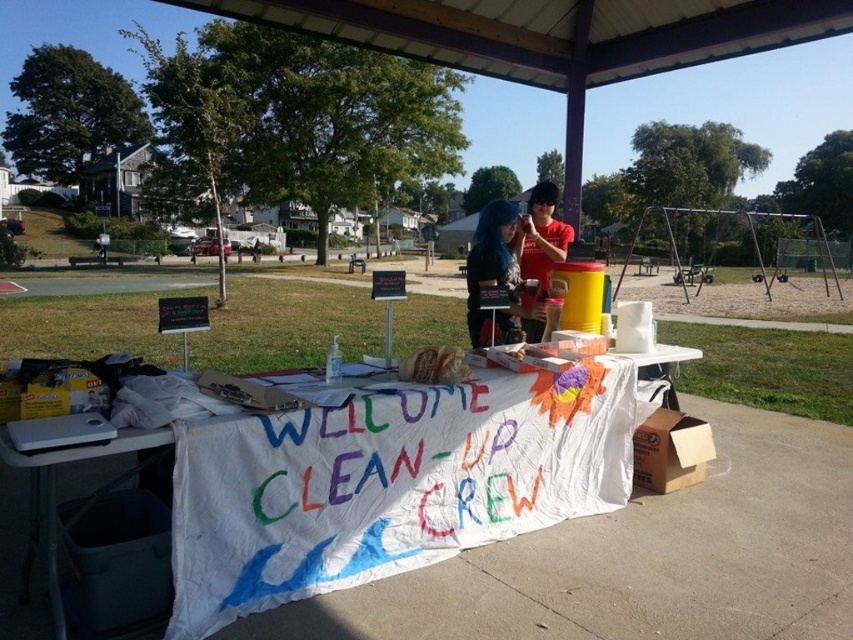
Is white cloth banner at center bigger than shiny blue hair at center?

No.

Can you confirm if white cloth banner at center is shorter than shiny blue hair at center?

Yes.

Is point (532, 497) behind point (506, 221)?

That is False.

This screenshot has height=640, width=853. Identify the location of white cloth banner at center. (393, 483).